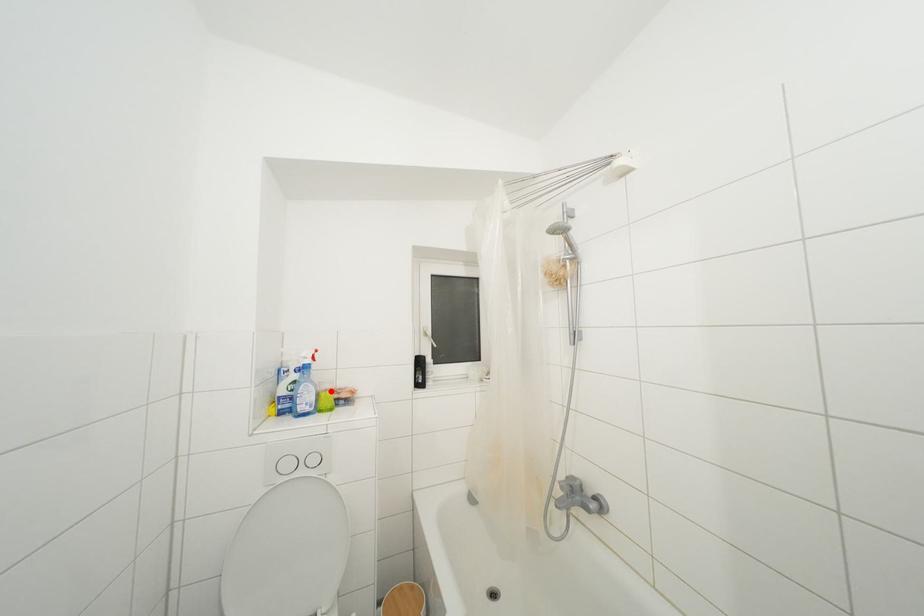
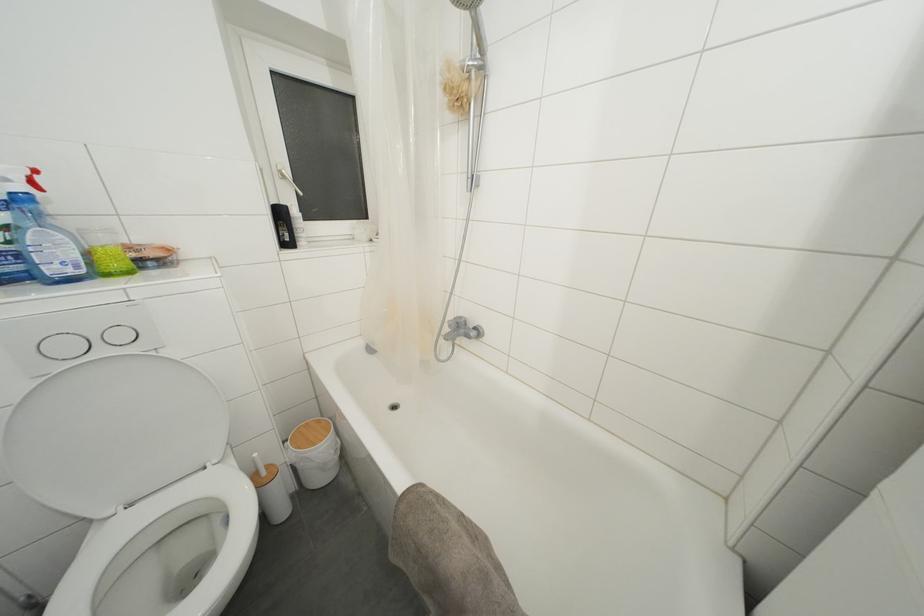
Question: I am providing you with two images of the same scene from different viewpoints. A red point is marked on the first image. Can you still see the location of the red point in image 2?

Choices:
 (A) Yes
 (B) No

Answer: (A)